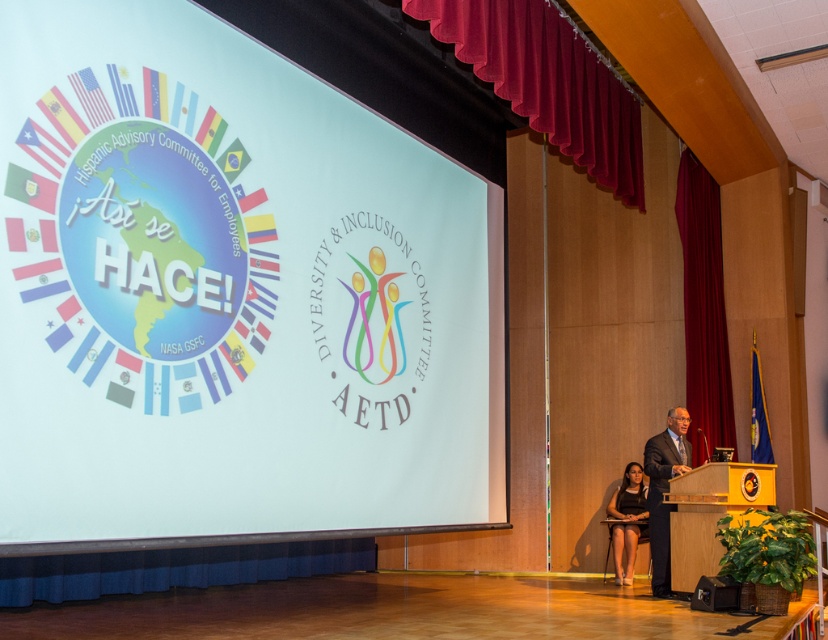
Question: Estimate the real-world distances between objects in this image. Which object is closer to the dark brown leather dress at lower right?

Choices:
 (A) wooden podium at center
 (B) white paper at center
 (C) black suit at center
 (D) maroon velvet curtain at right

Answer: (C)

Question: Does blue pleated fabric at lower center appear under black suit at center?

Choices:
 (A) yes
 (B) no

Answer: (A)

Question: Which point is closer to the camera?

Choices:
 (A) (614, 136)
 (B) (408, 472)

Answer: (B)

Question: Is velvet red curtain at upper center smaller than black suit at center?

Choices:
 (A) yes
 (B) no

Answer: (B)

Question: Can you confirm if maroon velvet curtain at right is positioned to the right of dark brown leather dress at lower right?

Choices:
 (A) no
 (B) yes

Answer: (B)

Question: Estimate the real-world distances between objects in this image. Which object is closer to the blue pleated fabric at lower center?

Choices:
 (A) white paper at center
 (B) velvet red curtain at upper center
 (C) wooden podium at center
 (D) maroon velvet curtain at right

Answer: (A)